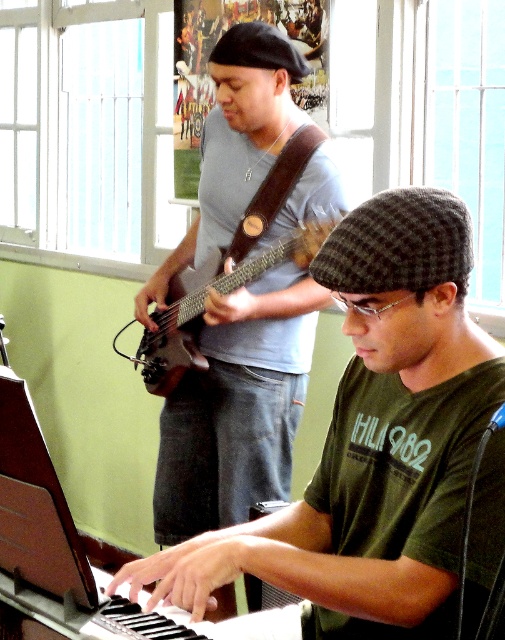
You are a photographer setting up for a concert photo shoot. You have a camera with a 50mm lens that can focus on objects up to 1 meter away. The matte gray shirt at center and the wooden electric guitar at center are both in your frame. Which object should you focus on to ensure it appears sharp in the photo?

The matte gray shirt at center is larger in size than the wooden electric guitar at center, so focusing on the matte gray shirt at center will ensure it appears sharp since it is closer to the camera within the 1 meter focus range.

You are a photographer setting up for a concert photo shoot. You need to ensure that the matte gray shirt at center and the wooden electric guitar at center are both in focus. Based on their positions, which one should you focus on first to ensure both are sharp?

The matte gray shirt at center is positioned under the wooden electric guitar at center. To ensure both are in focus, you should focus on the wooden electric guitar at center first since it is closer to the camera, and the matte gray shirt at center will naturally fall into focus as it is behind.

You are a photographer setting up for a concert photo shoot. You need to position a spotlight so it illuminates both the matte gray shirt at center and the wooden electric guitar at center. Since the spotlight can only shine in one direction, which object should you aim it towards first to ensure both are lit?

The spotlight should be aimed at the wooden electric guitar at center first because the matte gray shirt at center is to the right of it. By directing the light towards the guitar, the shirt to its right will also be illuminated.